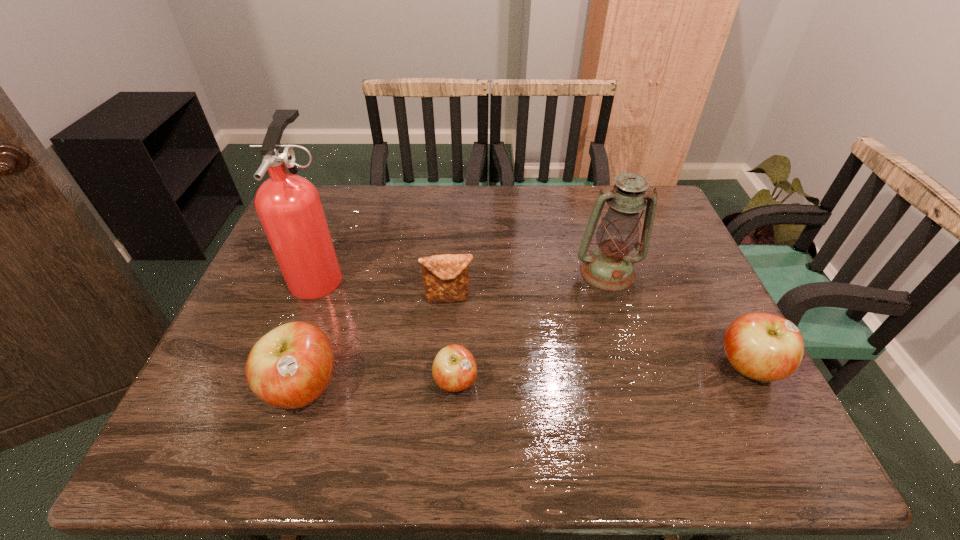
Where is `the leftmost apple`? This screenshot has height=540, width=960. the leftmost apple is located at coordinates (290, 367).

Find the location of a particular element. the second apple from left to right is located at coordinates (454, 369).

Locate an element on the screen. The image size is (960, 540). the shortest object is located at coordinates (454, 369).

At what (x,y) coordinates should I click in order to perform the action: click on the second shortest apple. Please return your answer as a coordinate pair (x, y). The image size is (960, 540). Looking at the image, I should click on (765, 347).

At what (x,y) coordinates should I click in order to perform the action: click on the rightmost object. Please return your answer as a coordinate pair (x, y). The height and width of the screenshot is (540, 960). Looking at the image, I should click on (765, 347).

The image size is (960, 540). Identify the location of clutch bag. (445, 277).

Where is `fire extinguisher`? The width and height of the screenshot is (960, 540). fire extinguisher is located at coordinates (289, 207).

Where is `the second object from right to left`? This screenshot has width=960, height=540. the second object from right to left is located at coordinates (609, 267).

Image resolution: width=960 pixels, height=540 pixels. Identify the location of oil lamp. (609, 267).

Find the location of a particular element. This screenshot has height=540, width=960. free spot located 0.250m on the back of the leftmost apple is located at coordinates (339, 280).